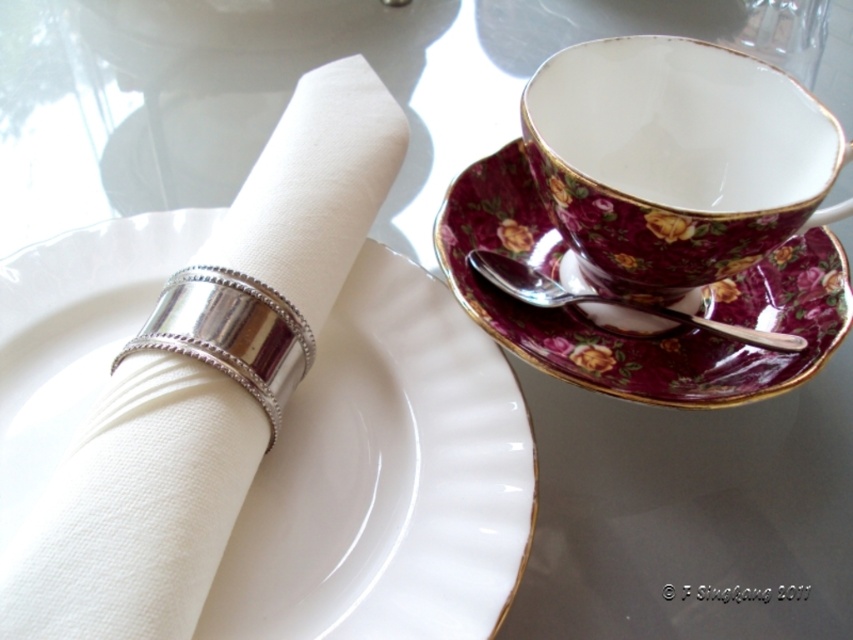
Is white porcelain plate at center shorter than maroon floral porcelain saucer at upper right?

No, white porcelain plate at center is not shorter than maroon floral porcelain saucer at upper right.

Is point (479, 356) farther from camera compared to point (521, 328)?

That is False.

You are a GUI agent. You are given a task and a screenshot of the screen. Output one action in this format:
    pyautogui.click(x=<x>, y=<y>)
    Task: Click on the white porcelain plate at center
    The image size is (853, 640).
    Given the screenshot: What is the action you would take?
    pyautogui.click(x=386, y=477)

Is white porcelain plate at center wider than silver metallic spoon at upper right?

In fact, white porcelain plate at center might be narrower than silver metallic spoon at upper right.

The image size is (853, 640). What do you see at coordinates (386, 477) in the screenshot? I see `white porcelain plate at center` at bounding box center [386, 477].

The image size is (853, 640). I want to click on white porcelain plate at center, so click(386, 477).

Which is more to the left, white porcelain plate at center or porcelain floral teacup at upper right?

white porcelain plate at center is more to the left.

What do you see at coordinates (386, 477) in the screenshot? Image resolution: width=853 pixels, height=640 pixels. I see `white porcelain plate at center` at bounding box center [386, 477].

At what (x,y) coordinates should I click in order to perform the action: click on white porcelain plate at center. Please return your answer as a coordinate pair (x, y). Looking at the image, I should click on (386, 477).